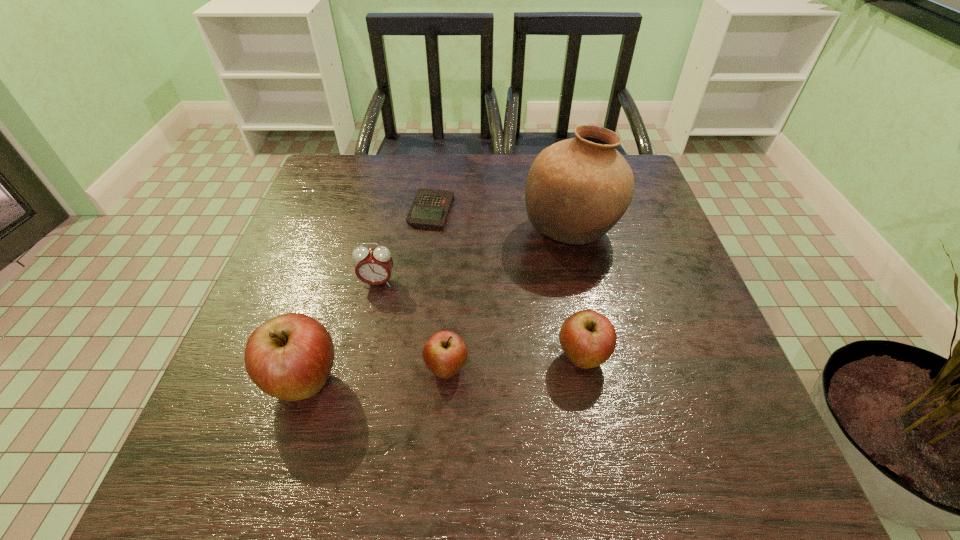
In order to click on free space for a new apple on the right in this screenshot , I will do `click(711, 346)`.